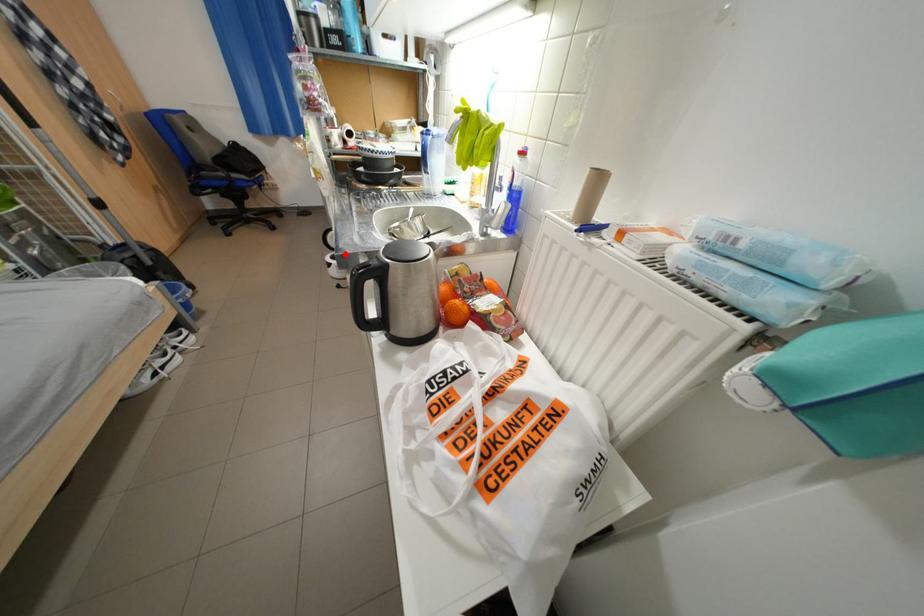
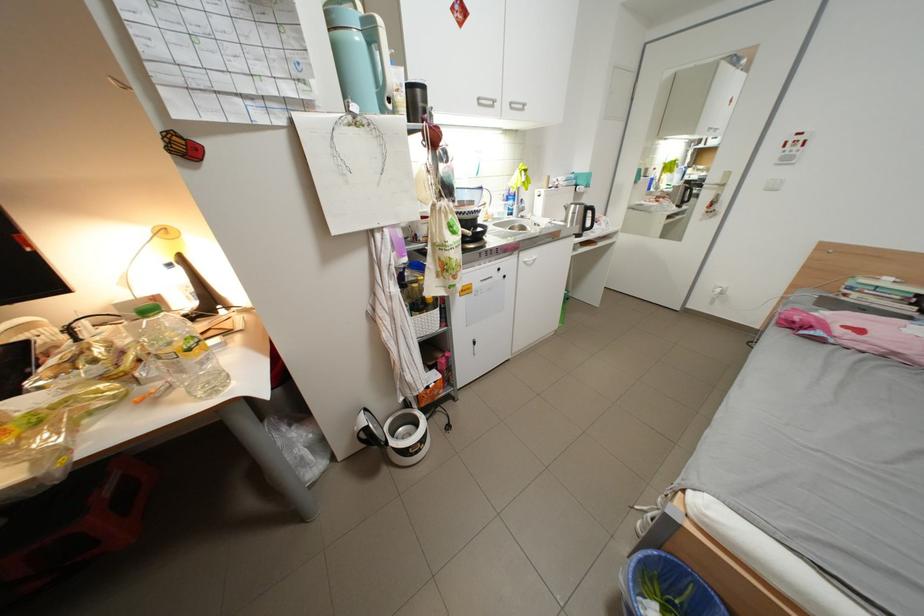
Question: I am providing you with two images of the same scene from different viewpoints. In image1, a red point is highlighted. Considering the same 3D point in image2, which of the following is correct?

Choices:
 (A) It is closer
 (B) It is farther

Answer: (A)